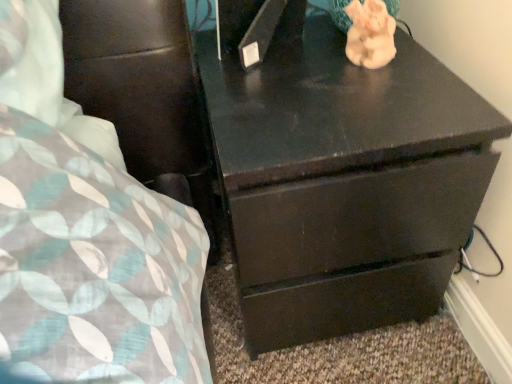
Where is `free spot above dark wood chest of drawers at center (from a real-world perspective)`? Image resolution: width=512 pixels, height=384 pixels. free spot above dark wood chest of drawers at center (from a real-world perspective) is located at coordinates (325, 86).